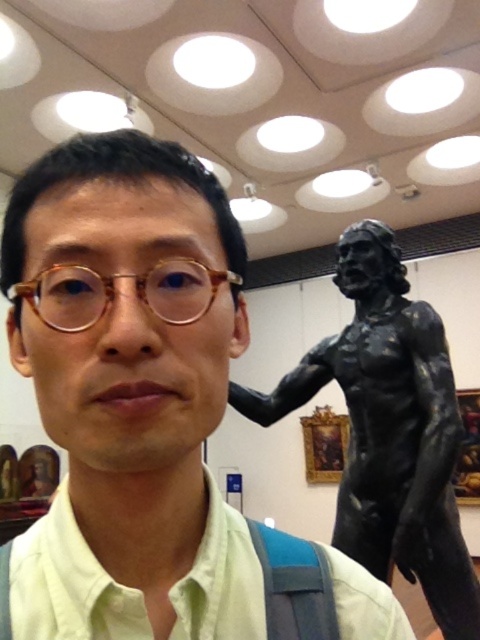
Does point (399, 384) come farther from viewer compared to point (29, 294)?

Yes, it is behind point (29, 294).

Can you confirm if black bronze statue at right is positioned above tortoiseshell frame glasses at center?

Actually, black bronze statue at right is below tortoiseshell frame glasses at center.

Locate an element on the screen. The width and height of the screenshot is (480, 640). black bronze statue at right is located at coordinates (388, 429).

The height and width of the screenshot is (640, 480). In order to click on black bronze statue at right in this screenshot , I will do `click(388, 429)`.

Between matte black statue at right and light green cotton shirt at center, which one has less height?

matte black statue at right is shorter.

At what (x,y) coordinates should I click in order to perform the action: click on matte black statue at right. Please return your answer as a coordinate pair (x, y). This screenshot has width=480, height=640. Looking at the image, I should click on (130, 396).

Locate an element on the screen. matte black statue at right is located at coordinates (130, 396).

Is matte black statue at right to the right of black bronze statue at right from the viewer's perspective?

In fact, matte black statue at right is to the left of black bronze statue at right.

This screenshot has height=640, width=480. What do you see at coordinates (130, 396) in the screenshot?
I see `matte black statue at right` at bounding box center [130, 396].

At what (x,y) coordinates should I click in order to perform the action: click on matte black statue at right. Please return your answer as a coordinate pair (x, y). Looking at the image, I should click on (130, 396).